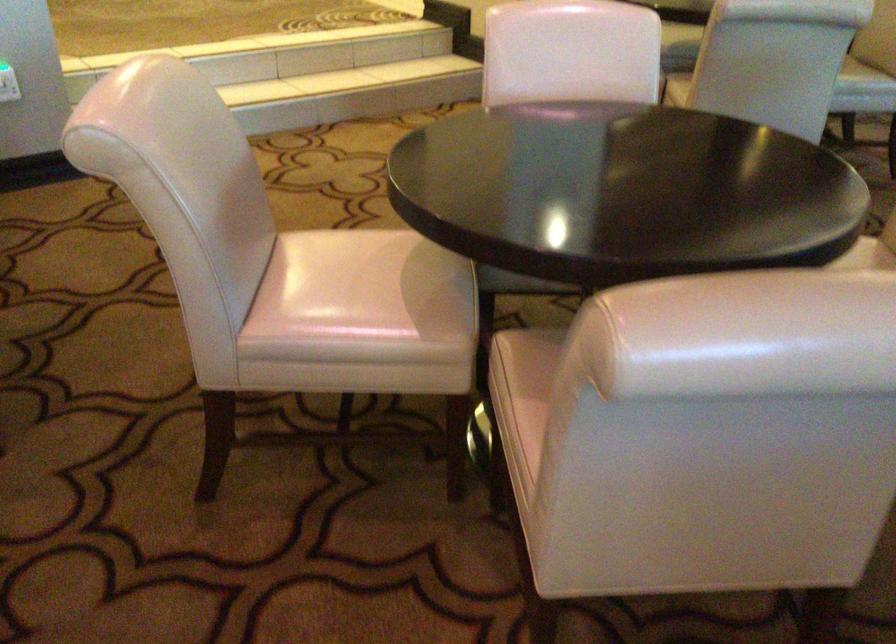
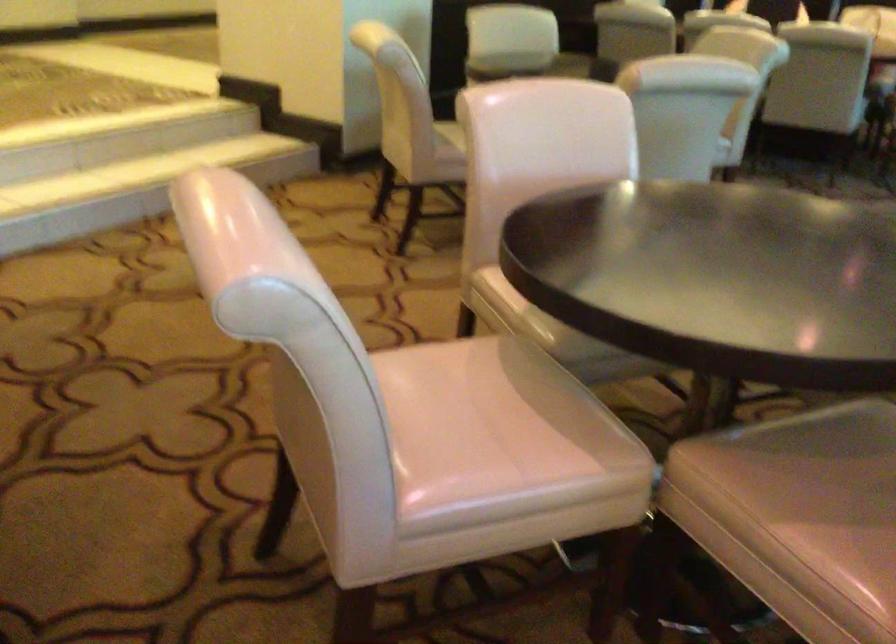
In a continuous first-person perspective shot, in which direction is the camera moving?

The cameraman walked toward left, forward.